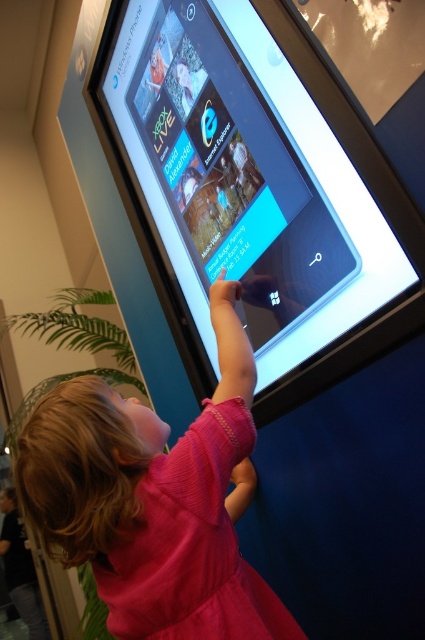
Can you confirm if pink fabric dress at center is positioned to the right of pink knit dress at lower left?

In fact, pink fabric dress at center is to the left of pink knit dress at lower left.

Does pink fabric dress at center have a lesser width compared to pink knit dress at lower left?

In fact, pink fabric dress at center might be wider than pink knit dress at lower left.

The height and width of the screenshot is (640, 425). I want to click on pink fabric dress at center, so click(153, 500).

Measure the distance from matte black touchscreen at upper center to pink fabric dress at center.

matte black touchscreen at upper center and pink fabric dress at center are 17.05 inches apart.

Does matte black touchscreen at upper center appear on the left side of pink fabric dress at center?

Indeed, matte black touchscreen at upper center is positioned on the left side of pink fabric dress at center.

Image resolution: width=425 pixels, height=640 pixels. In order to click on matte black touchscreen at upper center in this screenshot , I will do `click(255, 189)`.

This screenshot has height=640, width=425. In order to click on matte black touchscreen at upper center in this screenshot , I will do `click(255, 189)`.

Is matte black touchscreen at upper center bigger than pink knit dress at lower left?

Indeed, matte black touchscreen at upper center has a larger size compared to pink knit dress at lower left.

Does matte black touchscreen at upper center have a lesser width compared to pink knit dress at lower left?

Incorrect, matte black touchscreen at upper center's width is not less than pink knit dress at lower left's.

The height and width of the screenshot is (640, 425). Identify the location of matte black touchscreen at upper center. (255, 189).

Where is `matte black touchscreen at upper center`? The image size is (425, 640). matte black touchscreen at upper center is located at coordinates (255, 189).